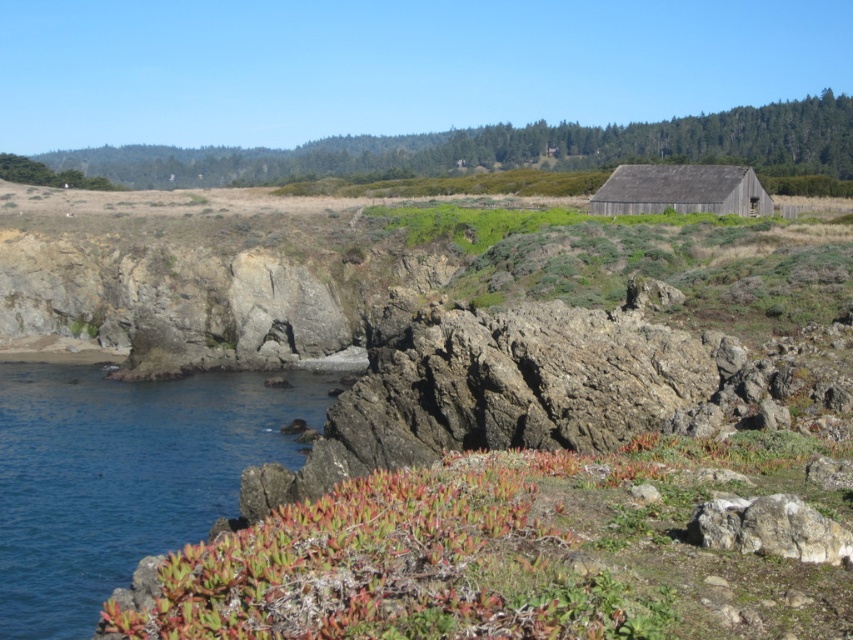
Is blue water at lower left bigger than gray rough rock at lower right?

Correct, blue water at lower left is larger in size than gray rough rock at lower right.

What do you see at coordinates (122, 476) in the screenshot? I see `blue water at lower left` at bounding box center [122, 476].

Does point (134, 506) come in front of point (759, 547)?

That is False.

Find the location of `blue water at lower left`. blue water at lower left is located at coordinates (122, 476).

Which is in front, point (431, 163) or point (714, 186)?

Point (714, 186)

Is green grassy field at center thinner than weathered wood barn at upper right?

In fact, green grassy field at center might be wider than weathered wood barn at upper right.

What do you see at coordinates (503, 148) in the screenshot? I see `green grassy field at center` at bounding box center [503, 148].

Identify the location of green grassy field at center. (503, 148).

Does green succulent at lower center appear on the right side of weathered wood barn at upper right?

Incorrect, green succulent at lower center is not on the right side of weathered wood barn at upper right.

Between green succulent at lower center and weathered wood barn at upper right, which one appears on the left side from the viewer's perspective?

green succulent at lower center

Who is more forward, [323,564] or [752,180]?

Point [323,564] is in front.

Find the location of `green succulent at lower center`. green succulent at lower center is located at coordinates (518, 554).